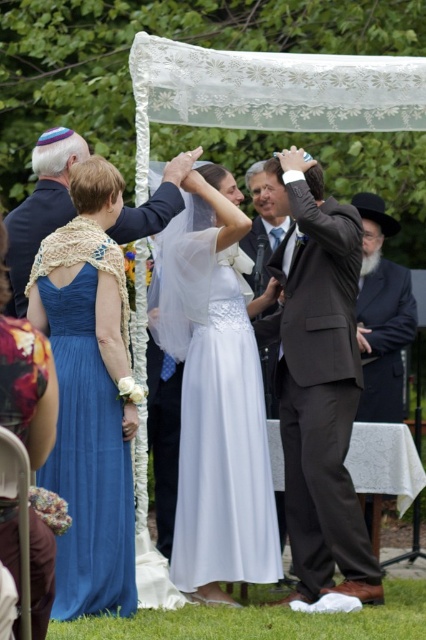
The width and height of the screenshot is (426, 640). Describe the element at coordinates (317, 380) in the screenshot. I see `dark brown suit at center` at that location.

Can you confirm if dark brown suit at center is taller than black wool hat at right?

Indeed, dark brown suit at center has a greater height compared to black wool hat at right.

Where is `dark brown suit at center`? Image resolution: width=426 pixels, height=640 pixels. dark brown suit at center is located at coordinates (317, 380).

Is dark brown suit at center to the right of blue satin dress at left from the viewer's perspective?

Indeed, dark brown suit at center is positioned on the right side of blue satin dress at left.

Is point (342, 547) positioned in front of point (109, 252)?

No, it is behind (109, 252).

Where is `dark brown suit at center`? dark brown suit at center is located at coordinates (317, 380).

Between blue satin dress at left and black wool hat at right, which one appears on the left side from the viewer's perspective?

Positioned to the left is blue satin dress at left.

Image resolution: width=426 pixels, height=640 pixels. What do you see at coordinates (88, 422) in the screenshot?
I see `blue satin dress at left` at bounding box center [88, 422].

What do you see at coordinates (88, 422) in the screenshot? I see `blue satin dress at left` at bounding box center [88, 422].

I want to click on blue satin dress at left, so click(x=88, y=422).